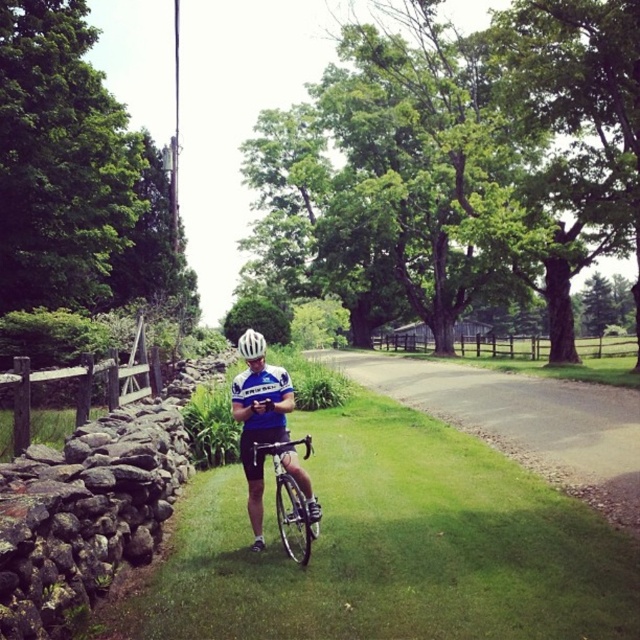
Question: Which of the following is the closest to the observer?

Choices:
 (A) (237, 348)
 (B) (532, 410)
 (C) (300, 513)

Answer: (C)

Question: Which object is closer to the camera taking this photo?

Choices:
 (A) white matte bicycle helmet at center
 (B) blue jersey at center

Answer: (B)

Question: Which point is farther from the camera taking this photo?

Choices:
 (A) (248, 493)
 (B) (241, 340)
 (C) (275, 452)

Answer: (A)

Question: Can you confirm if blue jersey at center is positioned to the left of silver metallic bicycle at center?

Choices:
 (A) yes
 (B) no

Answer: (A)

Question: Can you confirm if blue jersey at center is thinner than silver metallic bicycle at center?

Choices:
 (A) yes
 (B) no

Answer: (B)

Question: Does gravel road at center have a smaller size compared to white matte bicycle helmet at center?

Choices:
 (A) no
 (B) yes

Answer: (A)